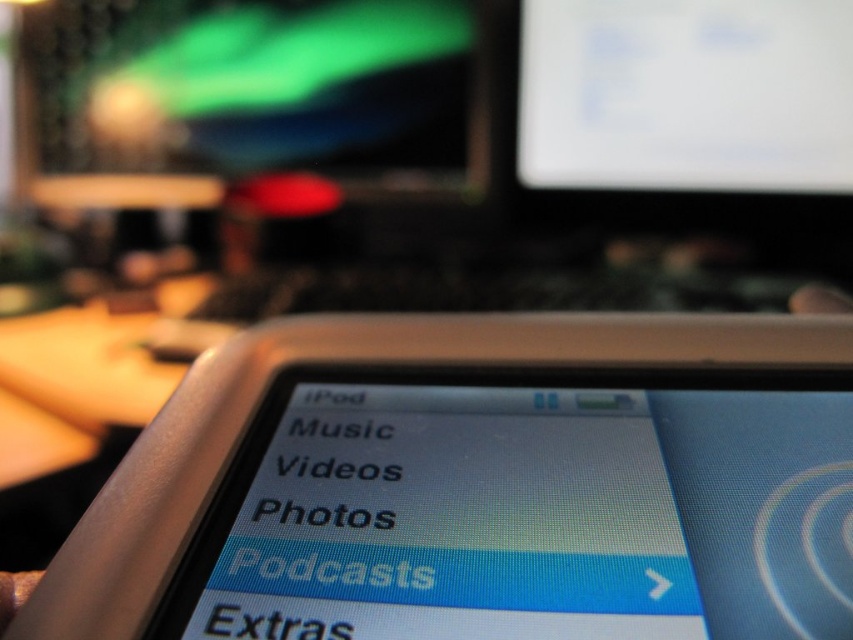
You are setting up a dual monitor setup and need to place the green matte monitor at upper left and white glossy monitor at upper center. Which monitor should be placed lower to avoid blocking the view of the other?

The green matte monitor at upper left should be placed lower because it is shorter than the white glossy monitor at upper center, so positioning it lower will prevent it from blocking the view of the taller white glossy monitor at upper center.

You are setting up a dual monitor workstation and need to place the green matte monitor at upper left and the white glossy monitor at upper center. Which monitor should be placed on the left side of the desk to ensure proper alignment?

The green matte monitor at upper left should be placed on the left side of the desk because it is bigger than the white glossy monitor at upper center, ensuring proper alignment.